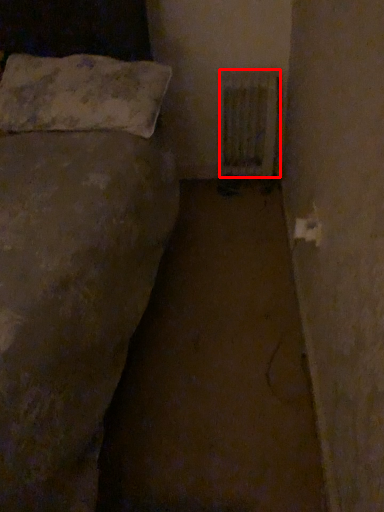
Question: From the image's perspective, where is radiator (annotated by the red box) located relative to pillow?

Choices:
 (A) above
 (B) below

Answer: (B)